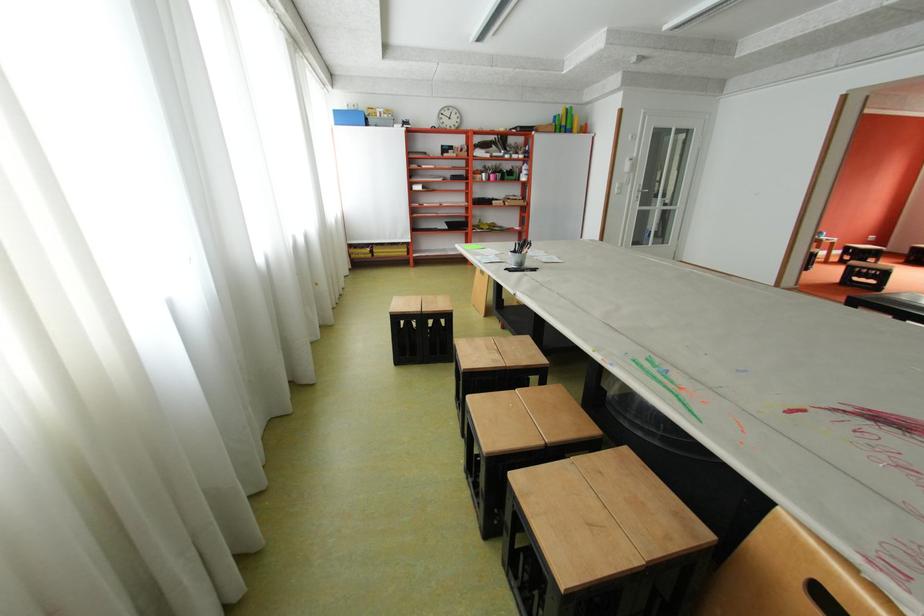
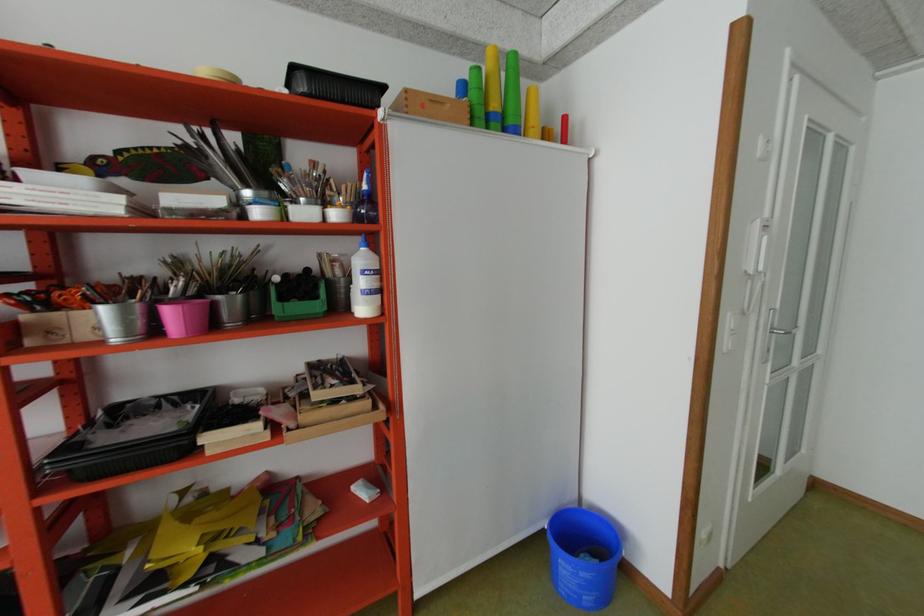
Locate, in the second image, the point that corresponds to point (517, 176) in the first image.

(292, 299)